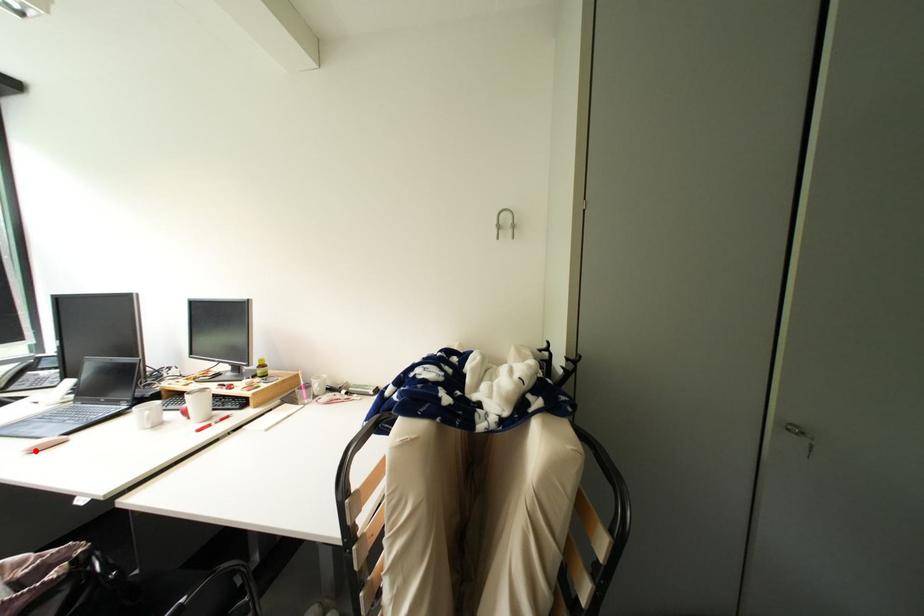
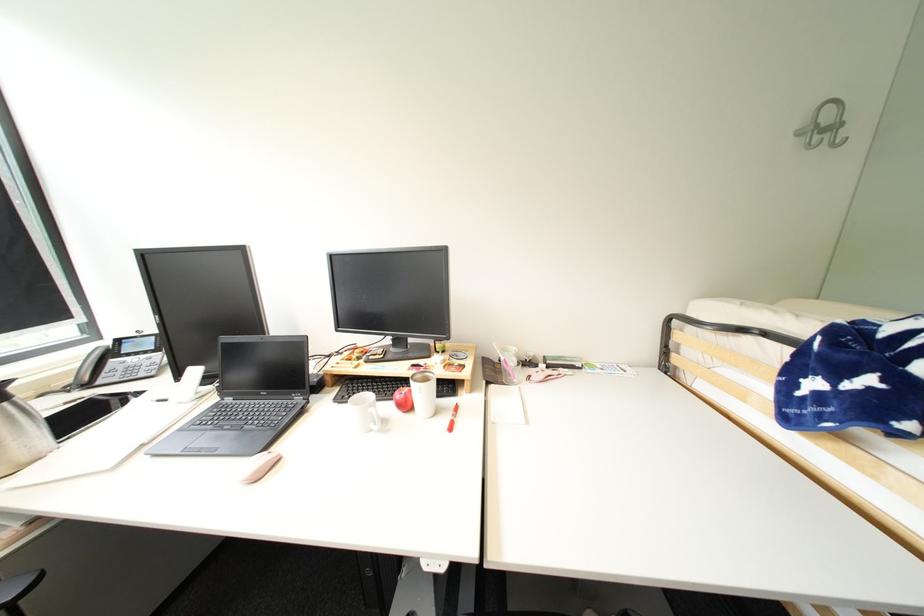
Locate, in the second image, the point that corresponds to the highlighted location in the first image.

(254, 480)